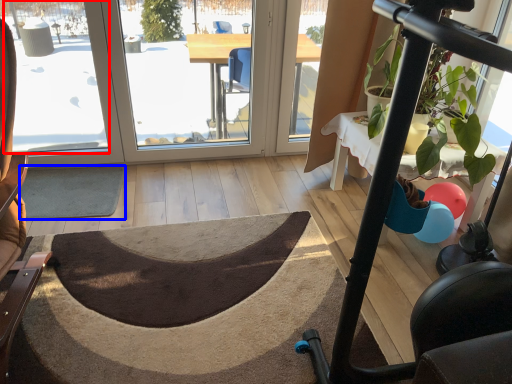
Question: Which object is further to the camera taking this photo, window screen (highlighted by a red box) or doormat (highlighted by a blue box)?

Choices:
 (A) window screen
 (B) doormat

Answer: (B)